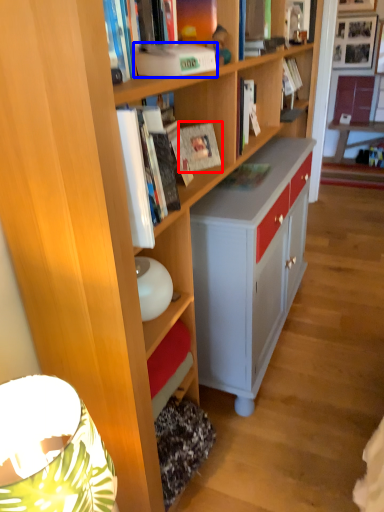
Question: Which object appears farthest to the camera in this image, paperback book (highlighted by a red box) or paperback book (highlighted by a blue box)?

Choices:
 (A) paperback book
 (B) paperback book

Answer: (A)